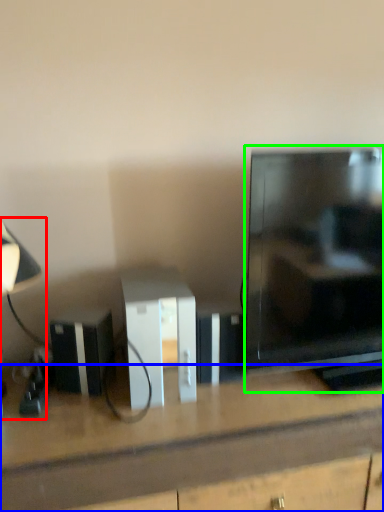
Question: Considering the real-world distances, which object is farthest from table lamp (highlighted by a red box)? desk (highlighted by a blue box) or television (highlighted by a green box)?

Choices:
 (A) desk
 (B) television

Answer: (B)